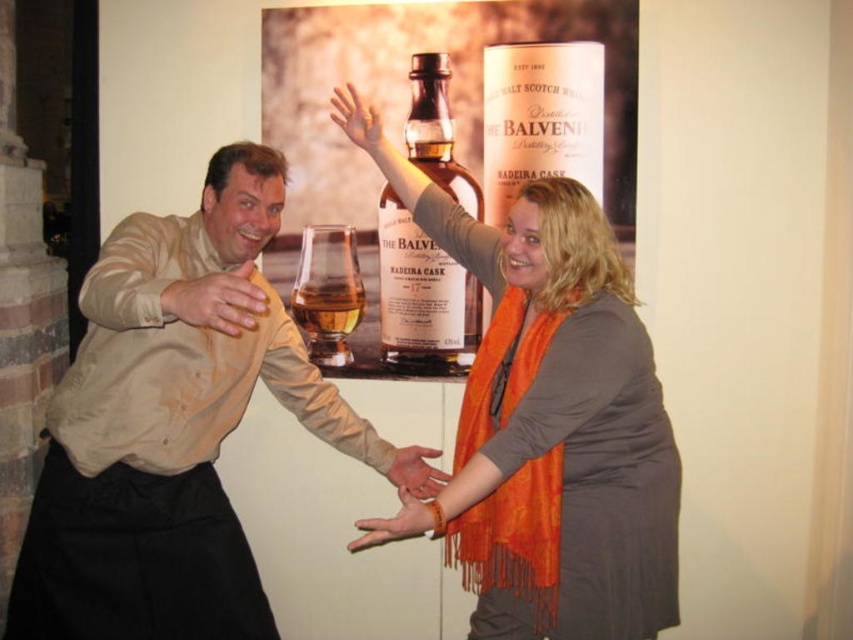
Based on the scene description, can you determine the spatial relationship between the translucent amber glass at center and the matte beige hand at lower left?

The translucent amber glass at center is located above the matte beige hand at lower left.

You are a photographer taking a picture of the translucent amber glass at center and the matte beige hand at lower left. Which object is closer to your camera lens?

The translucent amber glass at center is closer to the camera lens because it is further to the viewer than the matte beige hand at lower left.

You are a fashion designer observing the scene. You notice the matte beige shirt at center and the matte orange scarf at lower center. Which of these two items appears larger in size?

The matte beige shirt at center is bigger than the matte orange scarf at lower center.